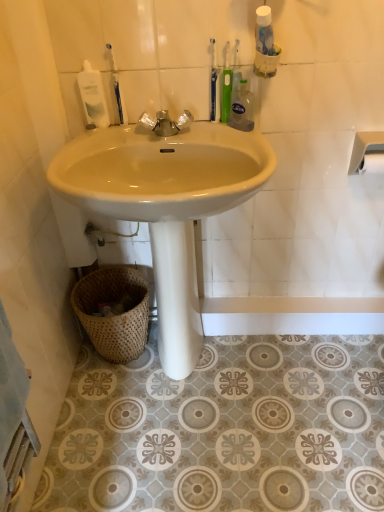
The image size is (384, 512). In order to click on vacant space that is in between matte silver faucet at center and green plastic toothbrush at upper center, positioned as the 1th toothbrush in right-to-left order in this screenshot , I will do `click(204, 131)`.